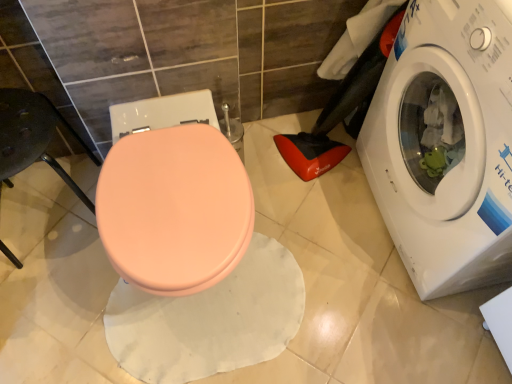
The image size is (512, 384). Find the location of `vacant area that lies between white glossy washing machine at right and matte pink bidet at center`. vacant area that lies between white glossy washing machine at right and matte pink bidet at center is located at coordinates (325, 236).